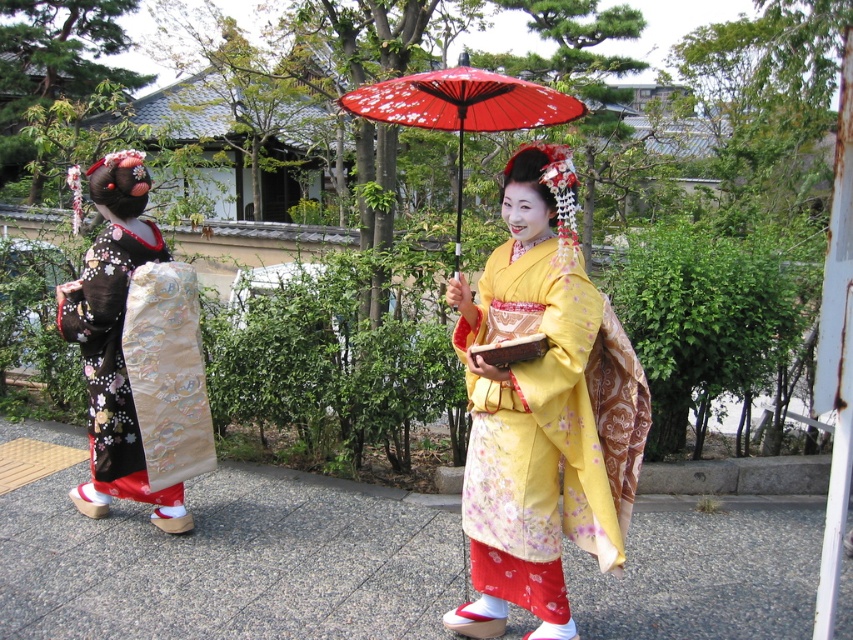
You are standing at point 0.5, 0.5 in the image coordinate system. You want to walk to the gray concrete pavement at center. Which direction should you move?

Since the gray concrete pavement at center is located at point (230, 563), you should move towards the northeast direction to reach it from your current position at (426, 320).

Looking at this image, you are standing at the point marked as point (230, 563) which is gray concrete pavement at center. You want to walk towards the person in the foreground wearing a vibrant yellow kimono. Is the path between you and the person clear?

The path between you and the person in the foreground wearing a vibrant yellow kimono is clear because the gray concrete pavement at center is indicated by point (230, 563), which suggests there is no obstruction.